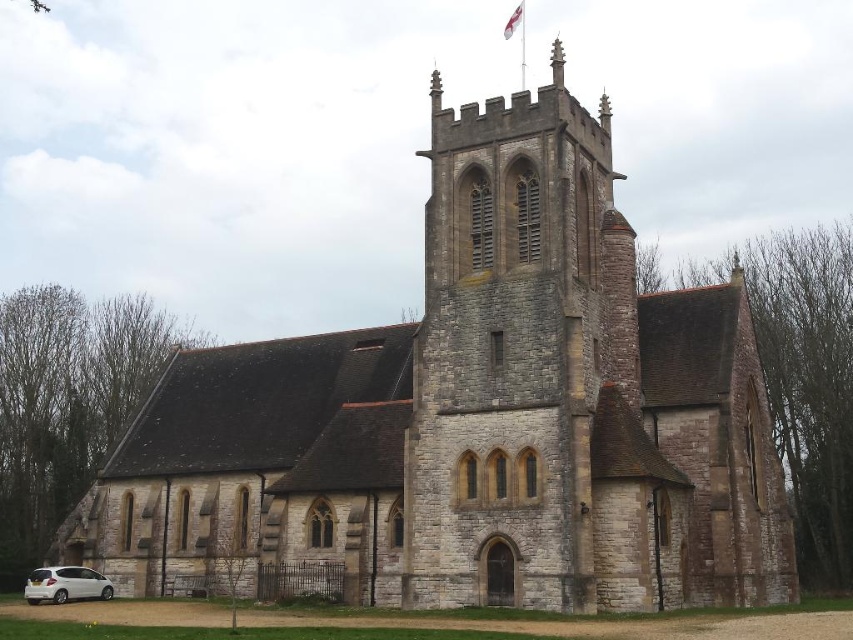
Question: From the image, what is the correct spatial relationship of white matte hatchback at lower left in relation to white fabric flag at upper center?

Choices:
 (A) right
 (B) left

Answer: (B)

Question: Which object appears farthest from the camera in this image?

Choices:
 (A) white fabric flag at upper center
 (B) white matte hatchback at lower left

Answer: (A)

Question: Is white matte hatchback at lower left behind white fabric flag at upper center?

Choices:
 (A) yes
 (B) no

Answer: (B)

Question: Which of the following is the farthest from the observer?

Choices:
 (A) white matte hatchback at lower left
 (B) white fabric flag at upper center

Answer: (B)

Question: Does white matte hatchback at lower left appear over white fabric flag at upper center?

Choices:
 (A) no
 (B) yes

Answer: (A)